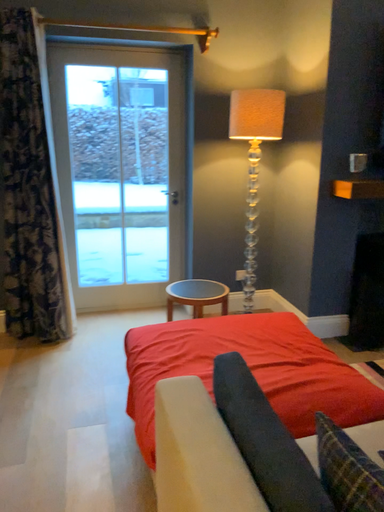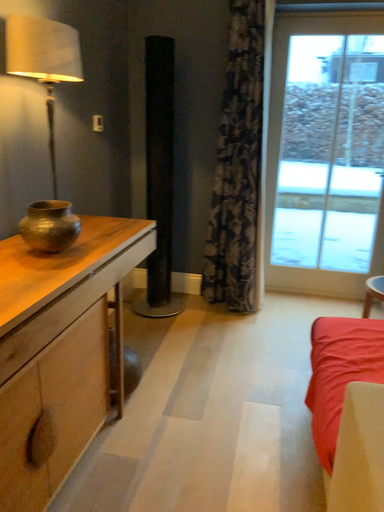
Question: Which way did the camera rotate in the video?

Choices:
 (A) rotated right
 (B) rotated left

Answer: (B)